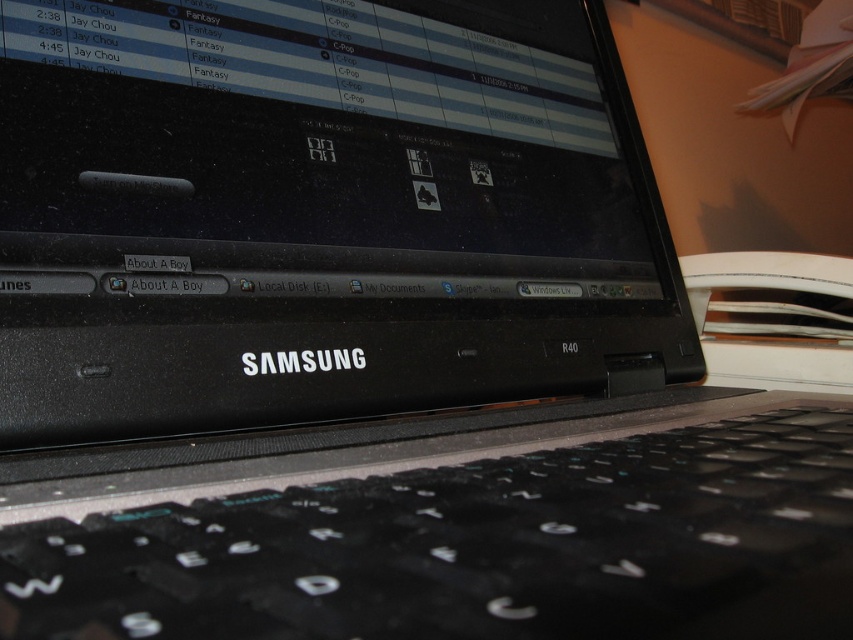
You are a graphic designer working on a project and need to place a watermark exactly at the center of the black matte computer screen at center. Given that the screen is positioned at point coordinates (312, 150), can you confirm if this point is indeed the center of the screen?

Yes, the point at coordinates (312, 150) is the center of the black matte computer screen at center as stated in the description.

You are a photographer trying to capture a close shot of the laptop screen. You notice two points on the screen at coordinates point (19, 76) and point (561, 621). Which point will appear larger in your photo?

Point (19, 76) is further to the camera than point (561, 621), so it will appear larger in the photo.